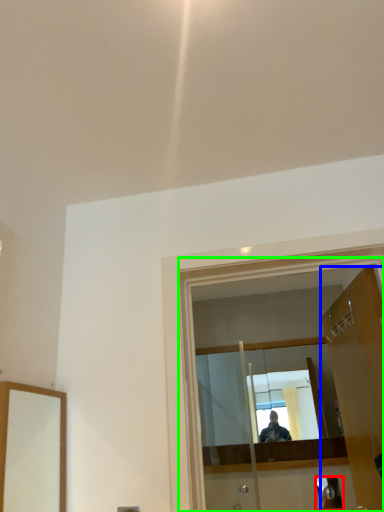
Question: Which is farther away from reflection (highlighted by a red box)? door (highlighted by a blue box) or glass door (highlighted by a green box)?

Choices:
 (A) door
 (B) glass door

Answer: (B)